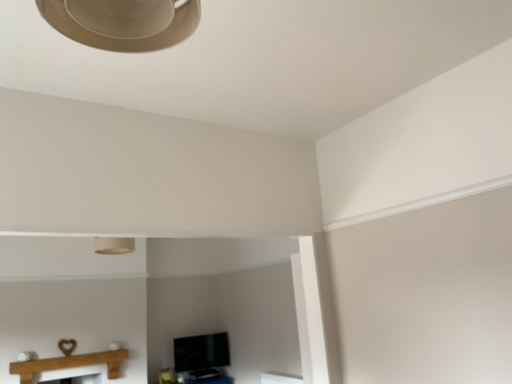
Question: Considering the positions of matte beige lampshade at upper center and wooden mantle at lower left in the image, is matte beige lampshade at upper center bigger or smaller than wooden mantle at lower left?

Choices:
 (A) big
 (B) small

Answer: (B)

Question: From the image's perspective, is matte beige lampshade at upper center located above or below wooden mantle at lower left?

Choices:
 (A) below
 (B) above

Answer: (B)

Question: Is matte beige lampshade at upper center to the left or to the right of wooden mantle at lower left in the image?

Choices:
 (A) right
 (B) left

Answer: (A)

Question: From the image's perspective, is wooden mantle at lower left positioned above or below matte beige lampshade at upper center?

Choices:
 (A) above
 (B) below

Answer: (B)

Question: Based on their sizes in the image, would you say wooden mantle at lower left is bigger or smaller than matte beige lampshade at upper center?

Choices:
 (A) small
 (B) big

Answer: (B)

Question: Does point (86, 354) appear closer or farther from the camera than point (131, 244)?

Choices:
 (A) closer
 (B) farther

Answer: (B)

Question: From a real-world perspective, is wooden mantle at lower left physically located above or below matte beige lampshade at upper center?

Choices:
 (A) above
 (B) below

Answer: (B)